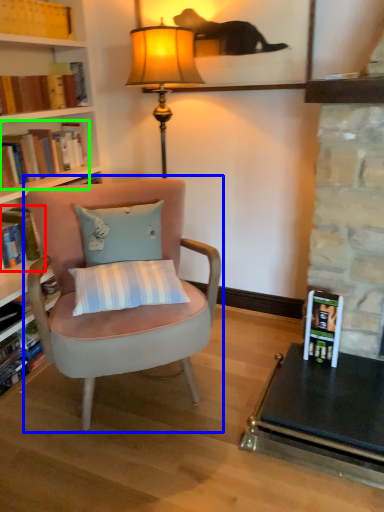
Question: Which is nearer to the book (highlighted by a red box)? chair (highlighted by a blue box) or book (highlighted by a green box).

Choices:
 (A) chair
 (B) book

Answer: (B)